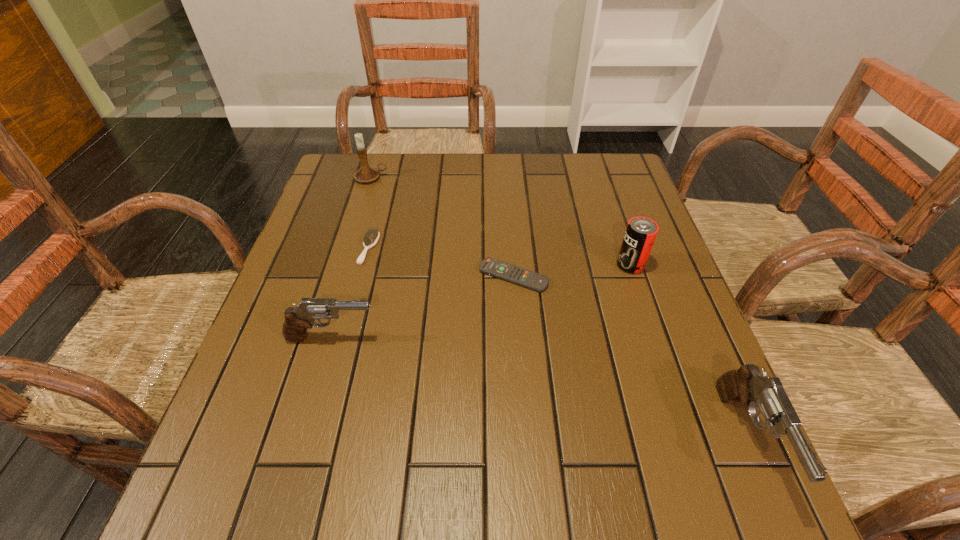
Find the location of `object that can be found as the fifth closest to the taller pistol`. object that can be found as the fifth closest to the taller pistol is located at coordinates (366, 174).

Select which object is the closest to the candle holder. Please provide its 2D coordinates. Your answer should be formatted as a tuple, i.e. [(x, y)], where the tuple contains the x and y coordinates of a point satisfying the conditions above.

[(372, 235)]

Locate an element on the screen. free location that satisfies the following two spatial constraints: 1. on the back side of the scrubbing brush; 2. on the side of the candle holder with the handle is located at coordinates point(388,178).

Find the location of a particular element. The height and width of the screenshot is (540, 960). free region that satisfies the following two spatial constraints: 1. on the side of the candle holder with the handle; 2. on the right side of the remote control is located at coordinates (341, 276).

The height and width of the screenshot is (540, 960). I want to click on vacant area in the image that satisfies the following two spatial constraints: 1. on the front side of the remote control; 2. on the left side of the scrubbing brush, so pyautogui.click(x=362, y=276).

Where is `vacant area in the image that satisfies the following two spatial constraints: 1. on the back side of the scrubbing brush; 2. on the side of the candle holder with the handle`? vacant area in the image that satisfies the following two spatial constraints: 1. on the back side of the scrubbing brush; 2. on the side of the candle holder with the handle is located at coordinates (388, 178).

Identify the location of free space that satisfies the following two spatial constraints: 1. on the side of the candle holder with the handle; 2. on the back side of the fifth object from left to right. The height and width of the screenshot is (540, 960). (344, 265).